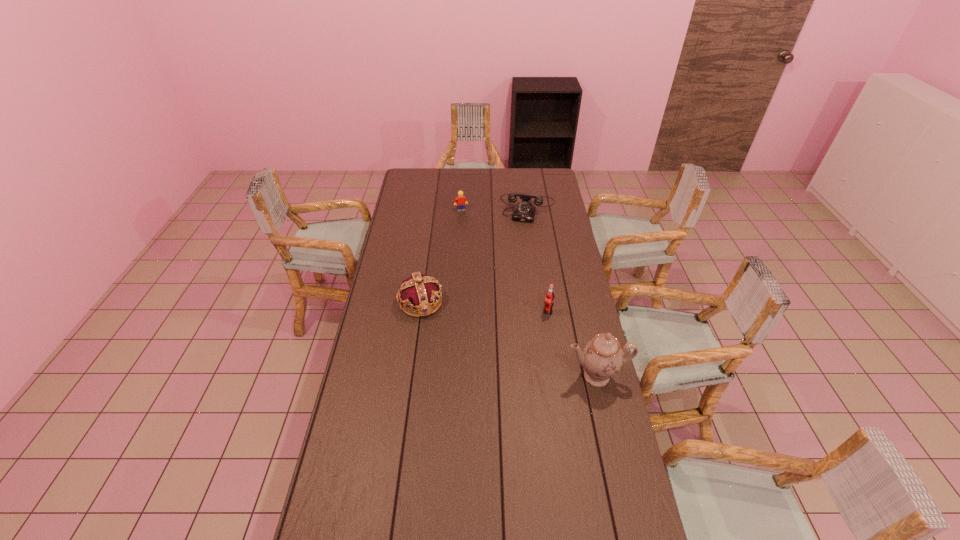
Where is `crown`? The height and width of the screenshot is (540, 960). crown is located at coordinates [420, 291].

This screenshot has width=960, height=540. Identify the location of chinaware. click(x=602, y=357).

Where is `the tallest object`? This screenshot has width=960, height=540. the tallest object is located at coordinates (602, 357).

Find the location of a particular element. telephone is located at coordinates (524, 211).

Where is `soda bottle`? This screenshot has width=960, height=540. soda bottle is located at coordinates (549, 297).

Find the location of a particular element. the fourth object from right to left is located at coordinates (460, 201).

Find the location of a particular element. vacant space located on the back of the crown is located at coordinates (430, 234).

The height and width of the screenshot is (540, 960). Identify the location of vacant area situated 0.150m on the spout of the nearest object. (609, 433).

Where is `free region located on the front-facing side of the telephone`? The height and width of the screenshot is (540, 960). free region located on the front-facing side of the telephone is located at coordinates (521, 241).

The height and width of the screenshot is (540, 960). I want to click on vacant region located on the front-facing side of the telephone, so click(515, 274).